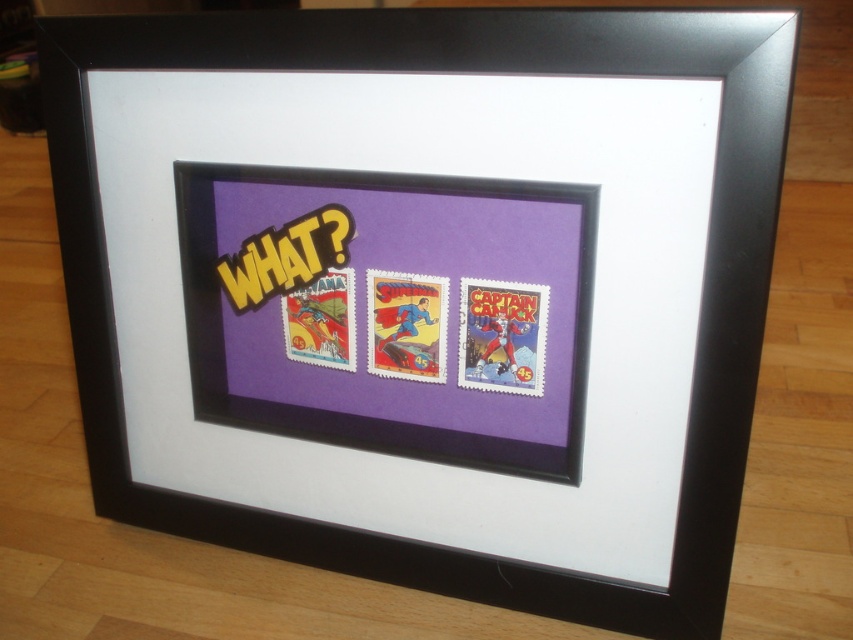
Question: Is matte purple stamp at center to the right of bright red paper stamp at center from the viewer's perspective?

Choices:
 (A) yes
 (B) no

Answer: (A)

Question: Which point is farther to the camera?

Choices:
 (A) (418, 353)
 (B) (512, 353)

Answer: (A)

Question: Is matte purple stamp at center thinner than bright red paper stamp at center?

Choices:
 (A) no
 (B) yes

Answer: (B)

Question: Is matte purple stamp at center above bright red paper stamp at center?

Choices:
 (A) yes
 (B) no

Answer: (B)

Question: Among these points, which one is nearest to the camera?

Choices:
 (A) (398, 307)
 (B) (480, 307)

Answer: (B)